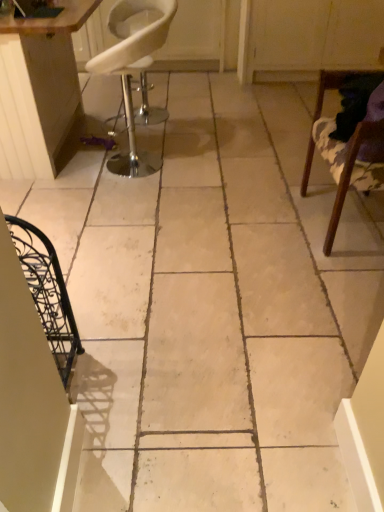
Find the location of `vacant space in front of wooden chair at right, acting as the first chair starting from the right`. vacant space in front of wooden chair at right, acting as the first chair starting from the right is located at coordinates (330, 287).